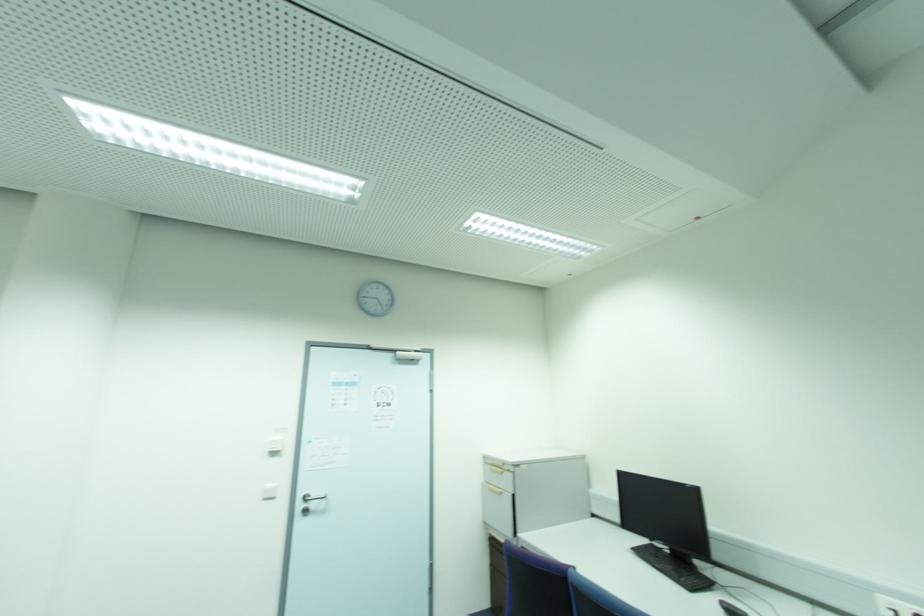
This screenshot has height=616, width=924. Describe the element at coordinates (312, 496) in the screenshot. I see `the silver door handle` at that location.